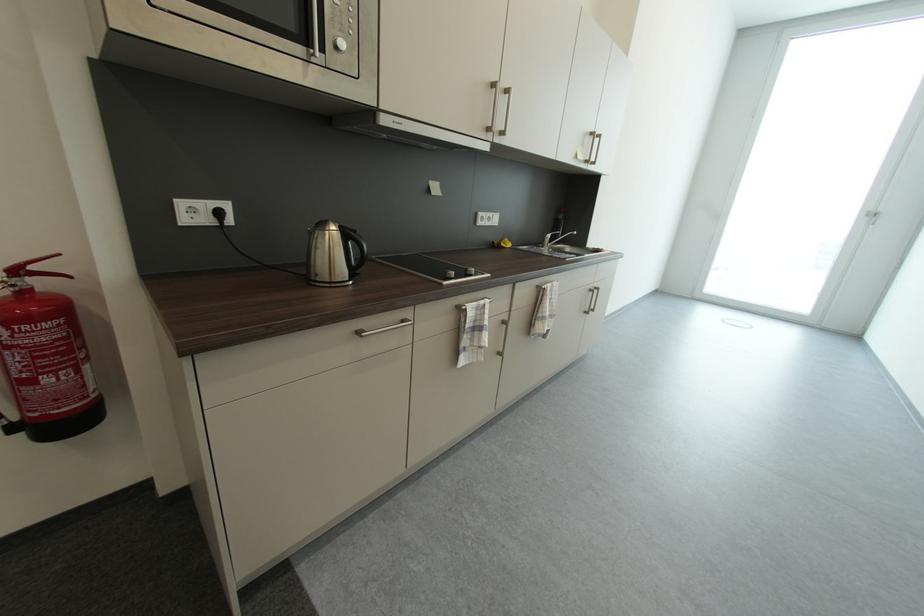
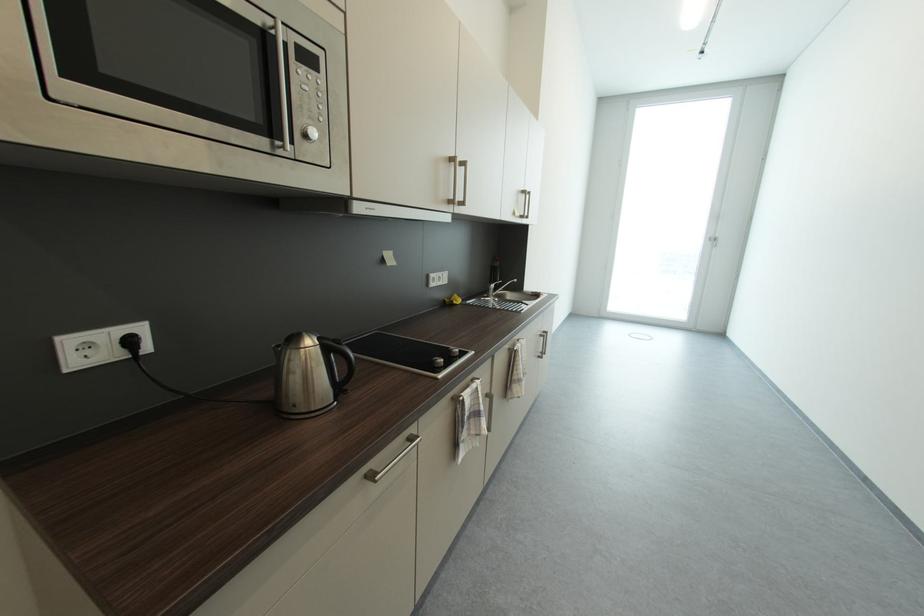
What movement of the cameraman would produce the second image?

The cameraman moved toward left, forward.